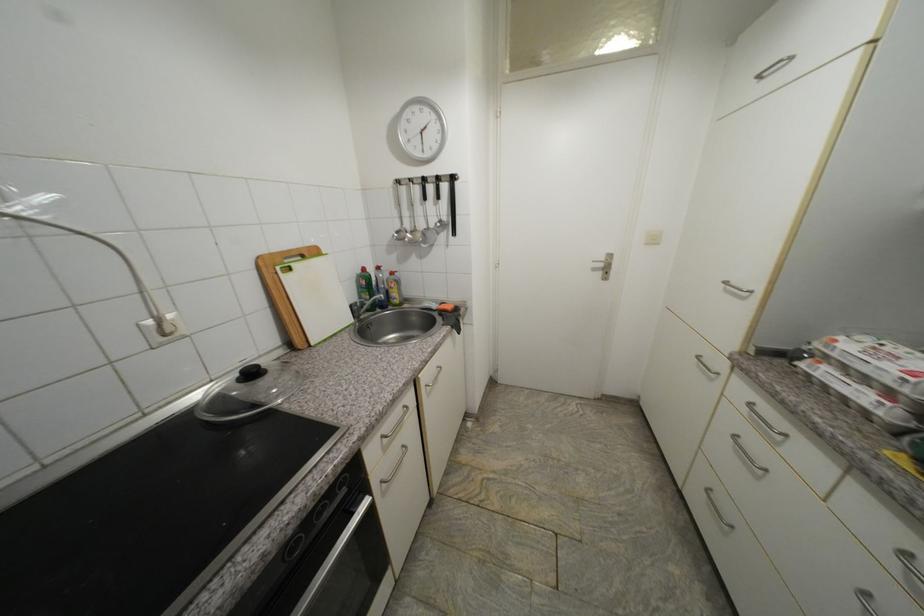
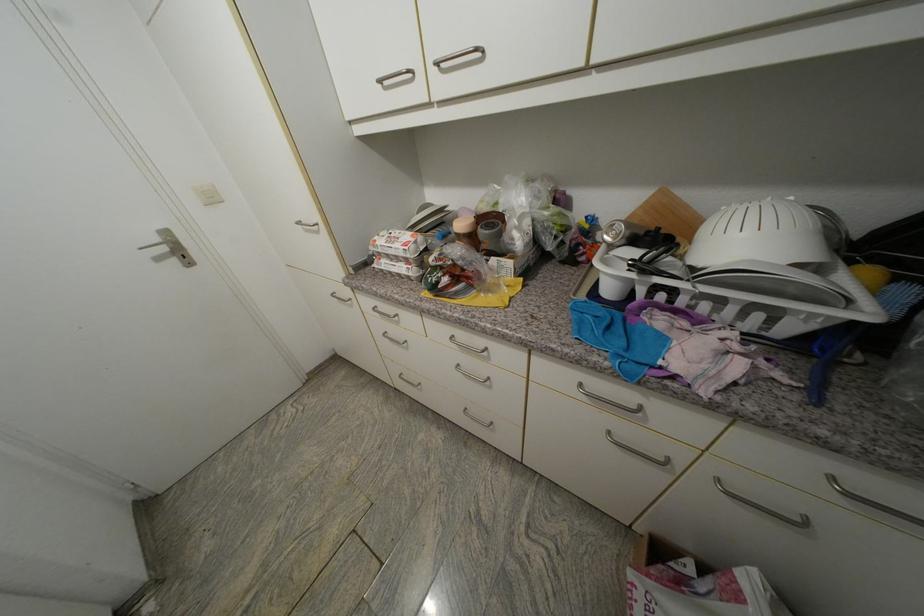
Based on the continuous images, in which direction is the camera rotating?

The camera rotated toward right-down.